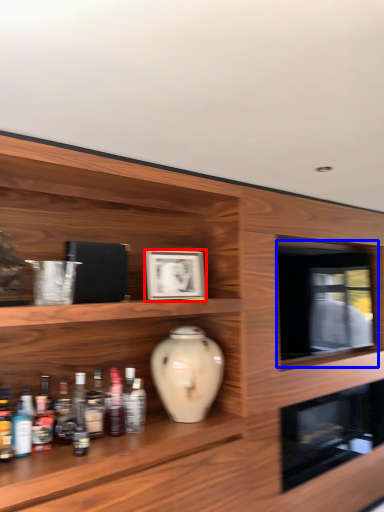
Question: Which point is closer to the camera, picture frame (highlighted by a red box) or oven (highlighted by a blue box)?

Choices:
 (A) picture frame
 (B) oven

Answer: (A)